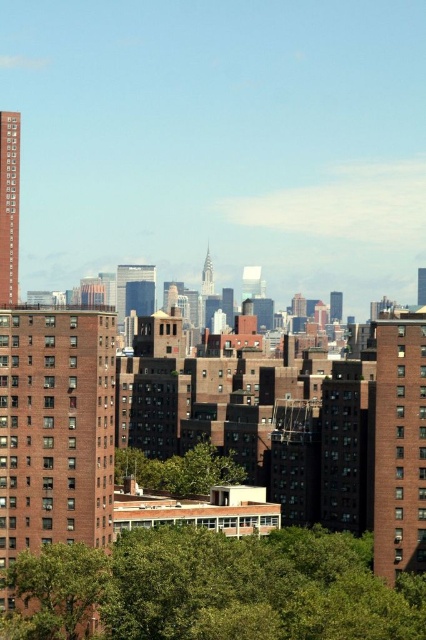
Question: Considering the relative positions of green leafy tree at lower center and green leafy tree at lower left in the image provided, where is green leafy tree at lower center located with respect to green leafy tree at lower left?

Choices:
 (A) above
 (B) below

Answer: (B)

Question: Which point is closer to the camera?

Choices:
 (A) green leafy tree at lower center
 (B) green leafy tree at lower left

Answer: (A)

Question: Which point appears closest to the camera in this image?

Choices:
 (A) (69, 564)
 (B) (221, 570)
 (C) (186, 464)

Answer: (A)

Question: Can you confirm if green leafy tree at lower left is smaller than green leafy tree at center?

Choices:
 (A) no
 (B) yes

Answer: (B)

Question: Which of the following is the farthest from the observer?

Choices:
 (A) [161, 484]
 (B) [362, 616]

Answer: (A)

Question: Can you confirm if green leafy tree at lower left is wider than green leafy tree at center?

Choices:
 (A) yes
 (B) no

Answer: (B)